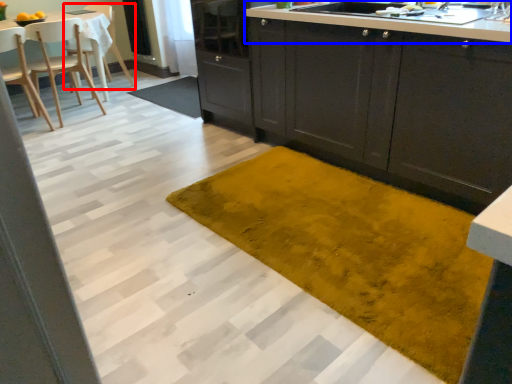
Question: Among these objects, which one is nearest to the camera, chair (highlighted by a red box) or countertop (highlighted by a blue box)?

Choices:
 (A) chair
 (B) countertop

Answer: (B)